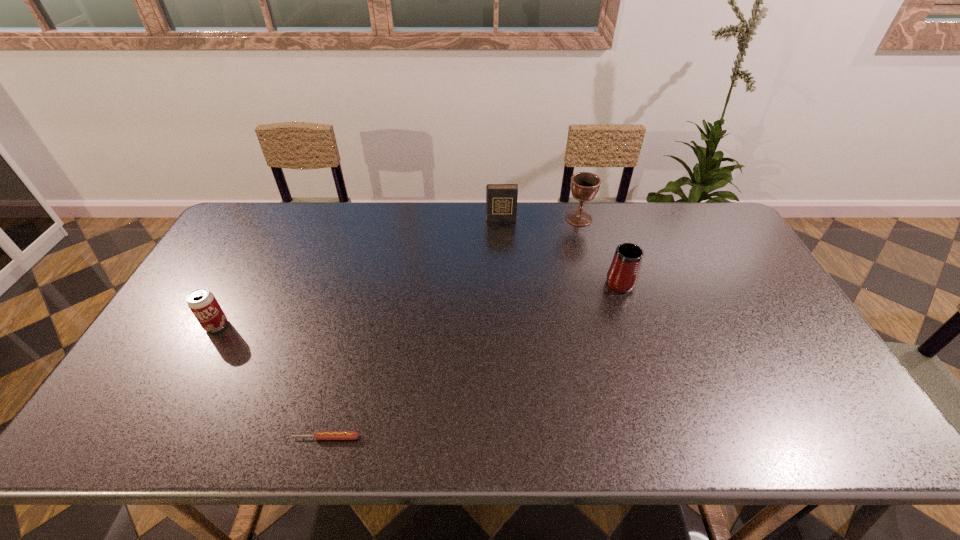
Locate an element on the screen. The width and height of the screenshot is (960, 540). unoccupied area between the nearest object and the chalice is located at coordinates (452, 328).

Where is `vacant space that's between the diary and the mug`? vacant space that's between the diary and the mug is located at coordinates (560, 250).

In order to click on free space between the third farthest object and the second nearest object in this screenshot , I will do `click(418, 303)`.

Point out which object is positioned as the second nearest to the chalice. Please provide its 2D coordinates. Your answer should be formatted as a tuple, i.e. [(x, y)], where the tuple contains the x and y coordinates of a point satisfying the conditions above.

[(622, 276)]

Locate which object is the second closest to the chalice. Please provide its 2D coordinates. Your answer should be formatted as a tuple, i.e. [(x, y)], where the tuple contains the x and y coordinates of a point satisfying the conditions above.

[(622, 276)]